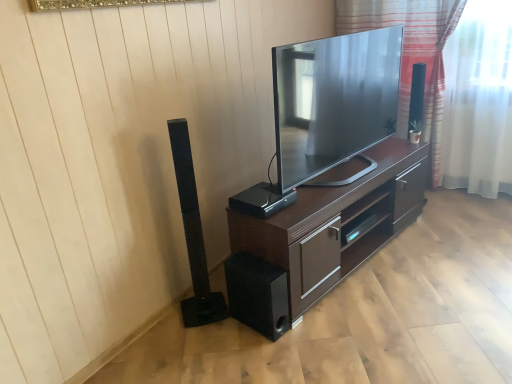
Where is `vacant region in front of striped fabric at upper right`? The image size is (512, 384). vacant region in front of striped fabric at upper right is located at coordinates (454, 227).